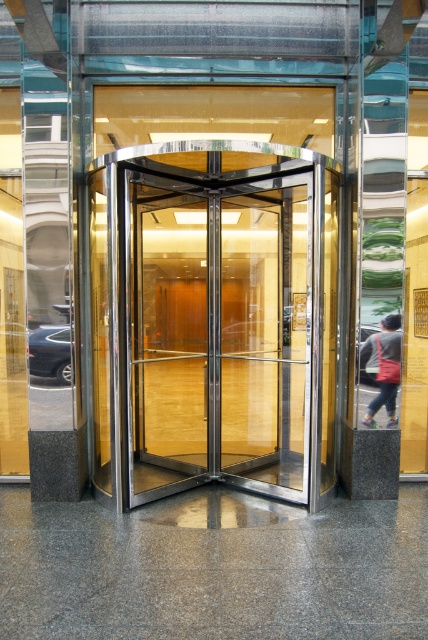
You are standing in front of the revolving door and need to enter the building. You notice the transparent glass door at center and the dark gray fabric jacket at right. Which object is taller?

The transparent glass door at center is much taller than the dark gray fabric jacket at right.

You are standing in front of the revolving door entrance and see the transparent glass door at center and the dark gray fabric jacket at right. Which object is located to the left of the other?

The transparent glass door at center is positioned on the left side of dark gray fabric jacket at right, so the transparent glass door at center is to the left of the dark gray fabric jacket at right.